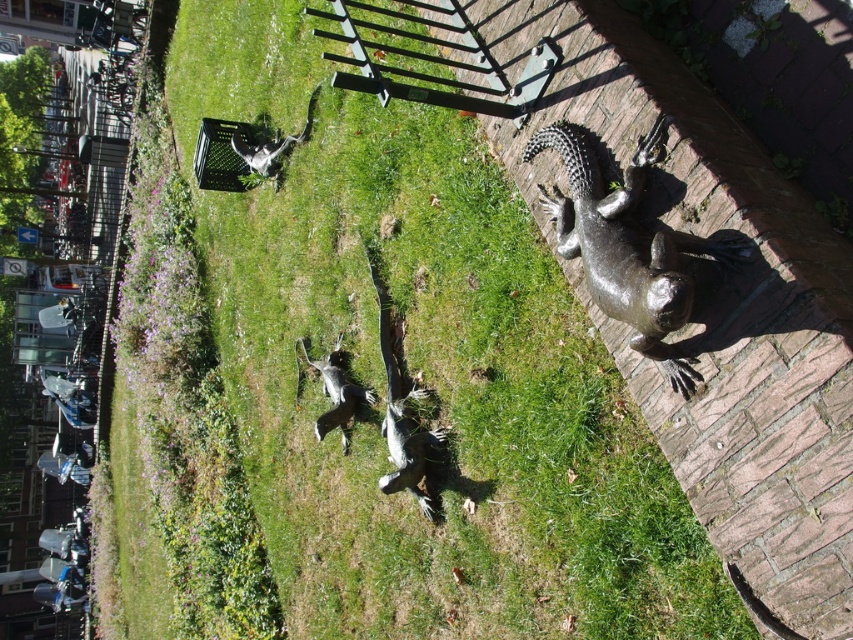
Question: Which object is positioned farthest from the shiny silver statue at center?

Choices:
 (A) shiny silver statue at upper left
 (B) shiny bronze iguana at right

Answer: (B)

Question: Does shiny silver statue at center appear under shiny silver statue at upper left?

Choices:
 (A) no
 (B) yes

Answer: (B)

Question: Which point is farther from the camera taking this photo?

Choices:
 (A) (583, 237)
 (B) (361, 392)
 (C) (258, 150)

Answer: (C)

Question: Can you confirm if shiny bronze iguana at right is positioned above shiny silver statue at center?

Choices:
 (A) yes
 (B) no

Answer: (A)

Question: Does shiny silver statue at center appear on the right side of shiny silver statue at upper left?

Choices:
 (A) yes
 (B) no

Answer: (A)

Question: Considering the real-world distances, which object is farthest from the shiny silver statue at center?

Choices:
 (A) shiny silver statue at upper left
 (B) shiny bronze iguana at right

Answer: (B)